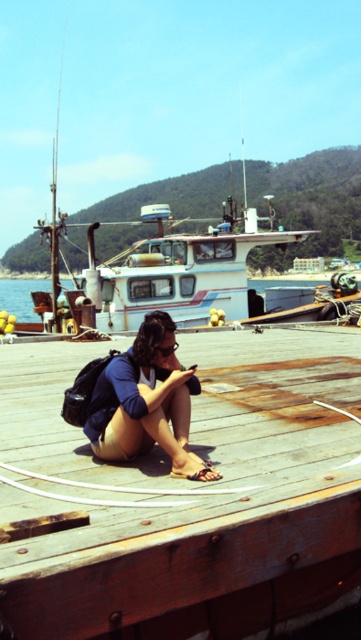
Who is more forward, (18,554) or (25,296)?

Point (18,554)

This screenshot has height=640, width=361. Find the location of `wooden at center`. wooden at center is located at coordinates (185, 497).

Does wooden at center appear on the left side of matte blue shorts at center?

Indeed, wooden at center is positioned on the left side of matte blue shorts at center.

Which of these two, wooden at center or matte blue shorts at center, stands taller?

matte blue shorts at center is taller.

Does point (174, 552) lie in front of point (144, 392)?

Yes, point (174, 552) is in front of point (144, 392).

At what (x,y) coordinates should I click in order to perform the action: click on wooden at center. Please return your answer as a coordinate pair (x, y). This screenshot has height=640, width=361. Looking at the image, I should click on (185, 497).

Does matte blue shorts at center appear on the right side of clear blue water at lower left?

Correct, you'll find matte blue shorts at center to the right of clear blue water at lower left.

Describe the element at coordinates (146, 403) in the screenshot. The height and width of the screenshot is (640, 361). I see `matte blue shorts at center` at that location.

You are a GUI agent. You are given a task and a screenshot of the screen. Output one action in this format:
    pyautogui.click(x=<x>, y=<y>)
    Task: Click on the matte blue shorts at center
    The image size is (361, 640).
    Given the screenshot: What is the action you would take?
    pyautogui.click(x=146, y=403)

Where is `matte blue shorts at center`? matte blue shorts at center is located at coordinates (146, 403).